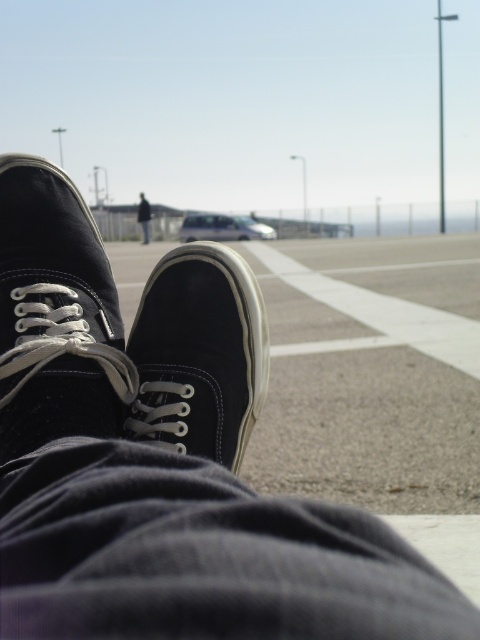
Is point (16, 236) more distant than point (195, 312)?

Yes, point (16, 236) is farther from viewer.

Is point (93, 422) positioned before point (189, 356)?

Yes, it is.

Is point (106, 282) farther from camera compared to point (136, 429)?

Yes.

What are the coordinates of `matte black shoe at lower left` in the screenshot? It's located at (56, 316).

Is matte black shoe at center to the right of dark blue jeans at center from the viewer's perspective?

Indeed, matte black shoe at center is positioned on the right side of dark blue jeans at center.

Is matte black shoe at center wider than dark blue jeans at center?

Incorrect, matte black shoe at center's width does not surpass dark blue jeans at center's.

Is point (216, 260) positioned before point (142, 227)?

Yes, point (216, 260) is in front of point (142, 227).

The width and height of the screenshot is (480, 640). What are the coordinates of `matte black shoe at center` in the screenshot? It's located at (199, 355).

Is matte black shoe at lower left to the left of dark blue jeans at center from the viewer's perspective?

Incorrect, matte black shoe at lower left is not on the left side of dark blue jeans at center.

What do you see at coordinates (56, 316) in the screenshot? This screenshot has width=480, height=640. I see `matte black shoe at lower left` at bounding box center [56, 316].

Locate an element on the screen. matte black shoe at lower left is located at coordinates (56, 316).